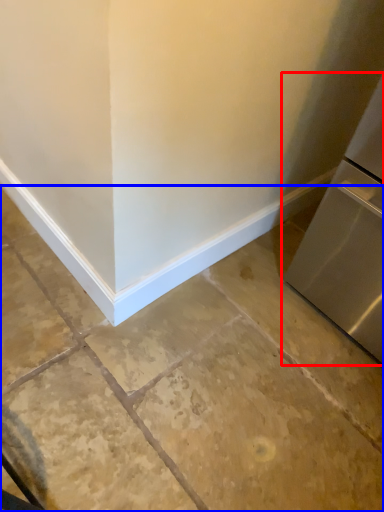
Question: Which point is further to the camera, refrigerator (highlighted by a red box) or concrete (highlighted by a blue box)?

Choices:
 (A) refrigerator
 (B) concrete

Answer: (B)